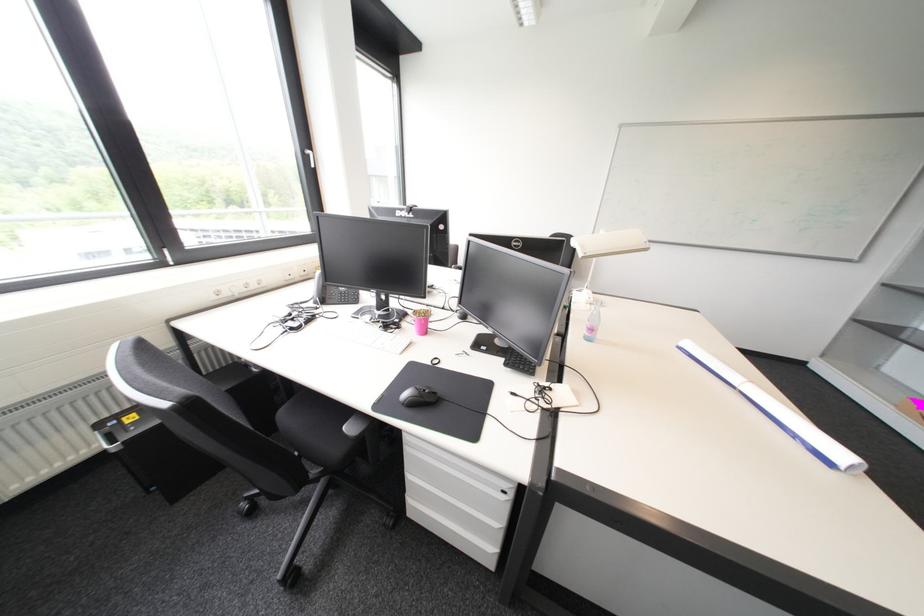
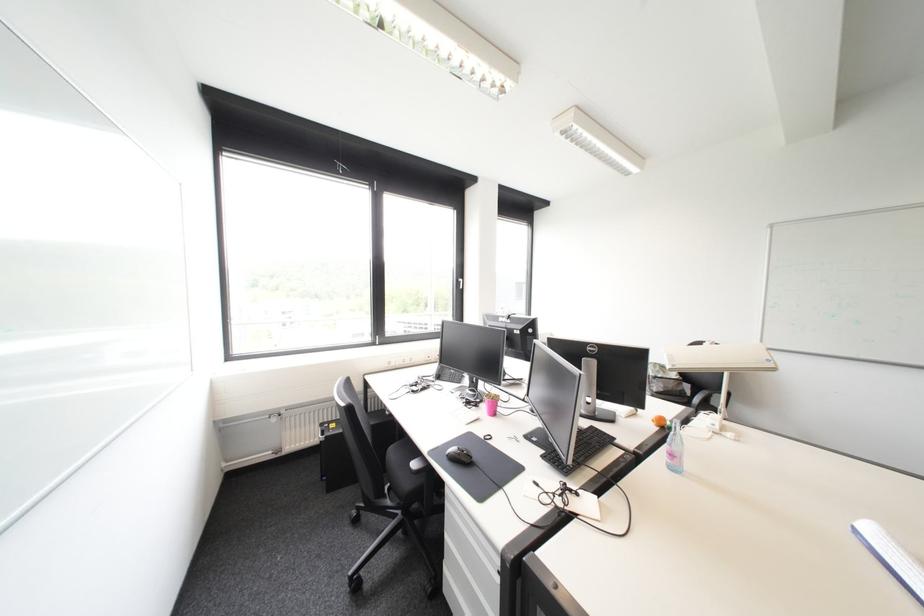
In the second image, find the point that corresponds to (426,318) in the first image.

(495, 400)